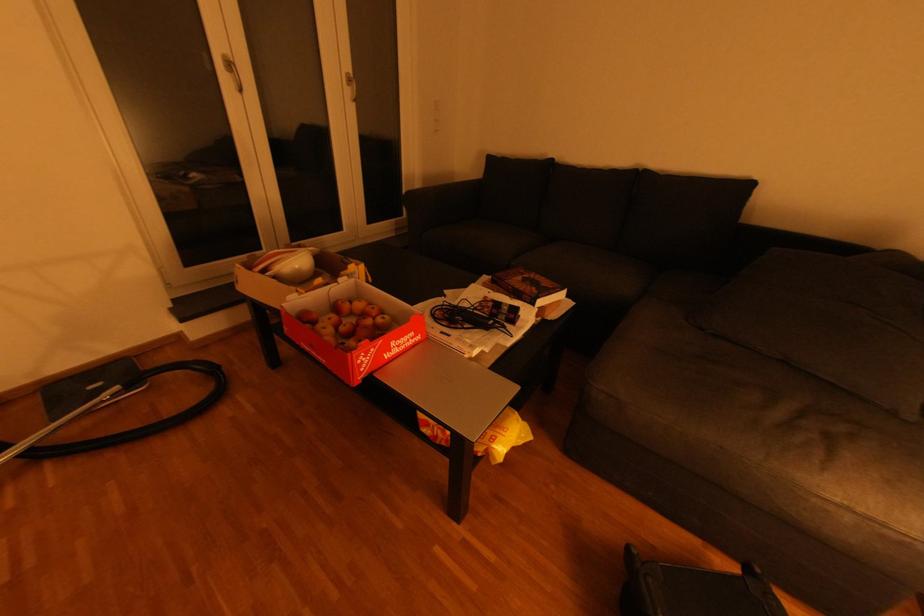
The location [293,267] corresponds to which object?

This point indicates the white bowl.